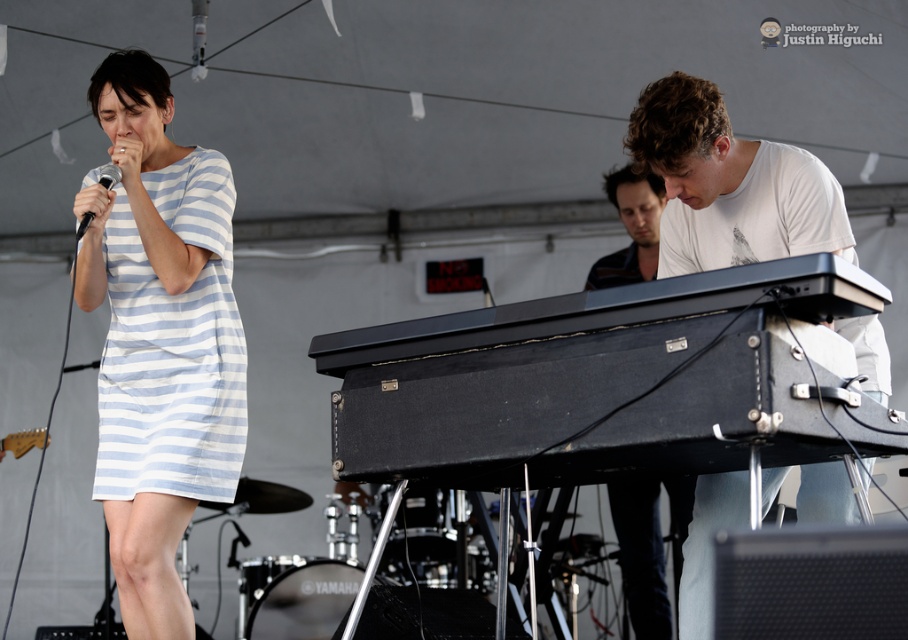
Is black leather piano at center taller than matte black microphone at left?

Indeed, black leather piano at center has a greater height compared to matte black microphone at left.

What are the coordinates of `black leather piano at center` in the screenshot? It's located at (596, 381).

Between point (346, 342) and point (114, 173), which one is positioned in front?

Point (346, 342) is in front.

The width and height of the screenshot is (908, 640). Find the location of `black leather piano at center`. black leather piano at center is located at coordinates (596, 381).

Which is behind, point (676, 317) or point (659, 605)?

The point (659, 605) is more distant.

Between point (718, 406) and point (627, 536), which one is positioned behind?

Point (627, 536)

Find the location of a particular element. black leather piano at center is located at coordinates (596, 381).

Is light blue and white striped fabric dress at left positioned at the back of white matte keyboard at right?

Yes, light blue and white striped fabric dress at left is further from the viewer.

Describe the element at coordinates (173, 346) in the screenshot. This screenshot has width=908, height=640. I see `light blue and white striped fabric dress at left` at that location.

Does point (232, 484) come in front of point (728, 132)?

No, (232, 484) is behind (728, 132).

You are a GUI agent. You are given a task and a screenshot of the screen. Output one action in this format:
    pyautogui.click(x=<x>, y=<y>)
    Task: Click on the light blue and white striped fabric dress at left
    
    Given the screenshot: What is the action you would take?
    pyautogui.click(x=173, y=346)